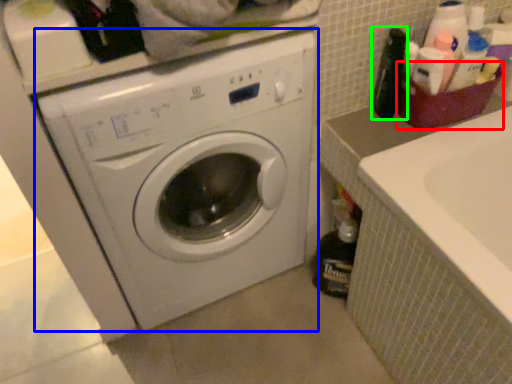
Question: Which object is positioned closest to basket (highlighted by a red box)? Select from washing machine (highlighted by a blue box) and bottle (highlighted by a green box).

Choices:
 (A) washing machine
 (B) bottle

Answer: (B)